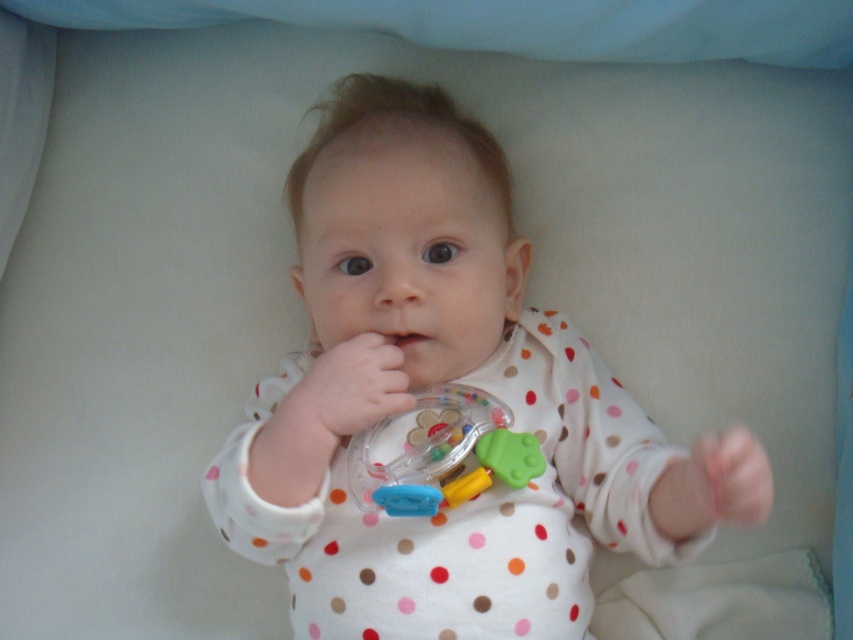
You are a pediatrician examining a baby in the image. You need to determine if the white polka dot onesie at center is covering the translucent plastic rattle at center. Based on the spatial relationship between these items, what is your conclusion?

The white polka dot onesie at center is located above the translucent plastic rattle at center, so it is covering the rattle.

You are a parent holding a baby in a white polka dot onesie at center and a translucent plastic toy at center. The baby is 18 inches long. Can the baby reach the toy while lying on their back?

The white polka dot onesie at center and translucent plastic toy at center are 5.94 inches apart. Since the baby is 18 inches long, they can easily reach the toy while lying on their back.